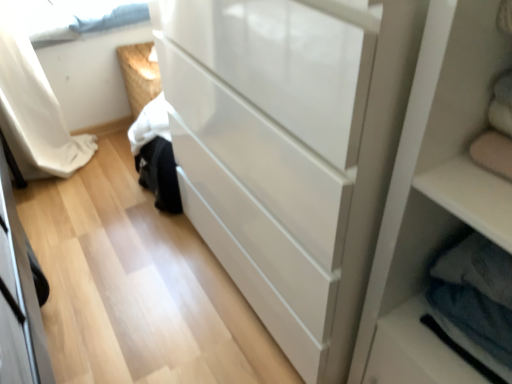
What do you see at coordinates (334, 160) in the screenshot? I see `glossy white chest of drawers at center` at bounding box center [334, 160].

What are the coordinates of `glossy white chest of drawers at center` in the screenshot? It's located at (334, 160).

The height and width of the screenshot is (384, 512). Find the location of `glossy white chest of drawers at center`. glossy white chest of drawers at center is located at coordinates (334, 160).